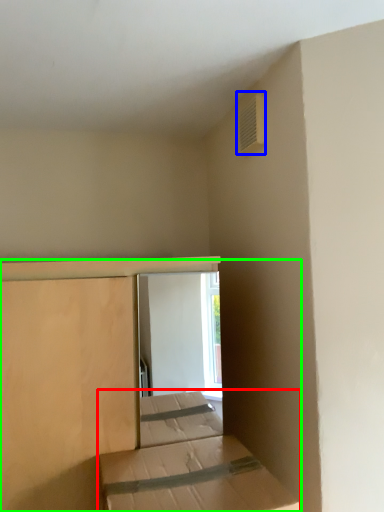
Question: Considering the real-world distances, which object is farthest from bed (highlighted by a red box)? air conditioning (highlighted by a blue box) or bed (highlighted by a green box)?

Choices:
 (A) air conditioning
 (B) bed

Answer: (A)